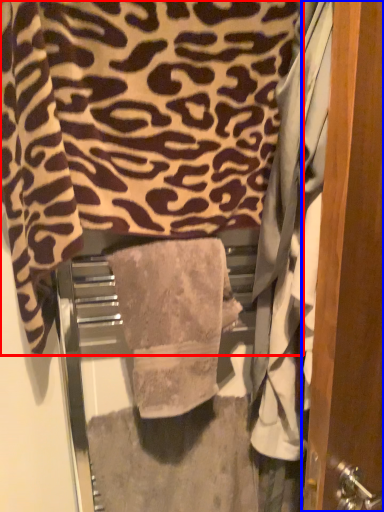
Question: Which of the following is the farthest to the observer, towel (highlighted by a red box) or door (highlighted by a blue box)?

Choices:
 (A) towel
 (B) door

Answer: (A)